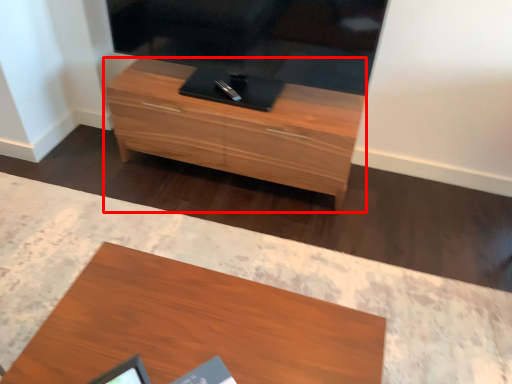
Question: From the image's perspective, where is chest of drawers (annotated by the red box) located in relation to desk in the image?

Choices:
 (A) below
 (B) above

Answer: (B)